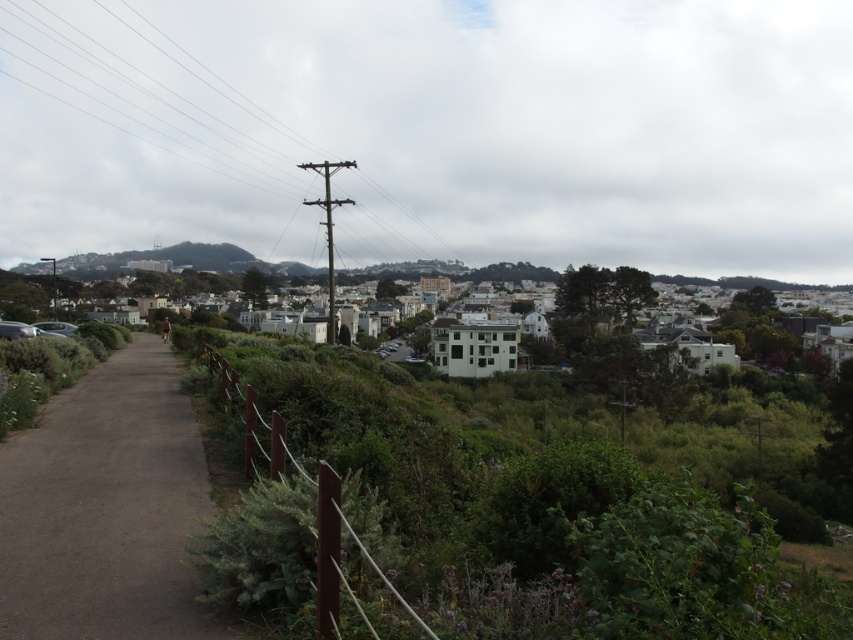
Who is more forward, [57,538] or [515,262]?

Point [57,538]

Between point (28, 529) and point (643, 298), which one is positioned behind?

Positioned behind is point (643, 298).

Locate an element on the screen. This screenshot has width=853, height=640. dirt path at center is located at coordinates (106, 508).

You are a GUI agent. You are given a task and a screenshot of the screen. Output one action in this format:
    pyautogui.click(x=<x>, y=<y>)
    Task: Click on the dirt path at center
    This screenshot has height=640, width=853.
    Given the screenshot: What is the action you would take?
    pyautogui.click(x=106, y=508)

Does wooden pole at upper center have a greater width compared to white matte building at center?

No.

Can you confirm if wooden pole at upper center is shorter than white matte building at center?

No, wooden pole at upper center is not shorter than white matte building at center.

Describe the element at coordinates (231, 125) in the screenshot. I see `wooden pole at upper center` at that location.

At what (x,y) coordinates should I click in order to perform the action: click on wooden pole at upper center. Please return your answer as a coordinate pair (x, y). This screenshot has width=853, height=640. Looking at the image, I should click on (231, 125).

Locate an element on the screen. wooden pole at upper center is located at coordinates (231, 125).

Can you confirm if wooden pole at upper center is bigger than dirt path at center?

Correct, wooden pole at upper center is larger in size than dirt path at center.

Measure the distance between wooden pole at upper center and camera.

wooden pole at upper center is 48.87 meters from camera.

Find the location of a particular element. wooden pole at upper center is located at coordinates (231, 125).